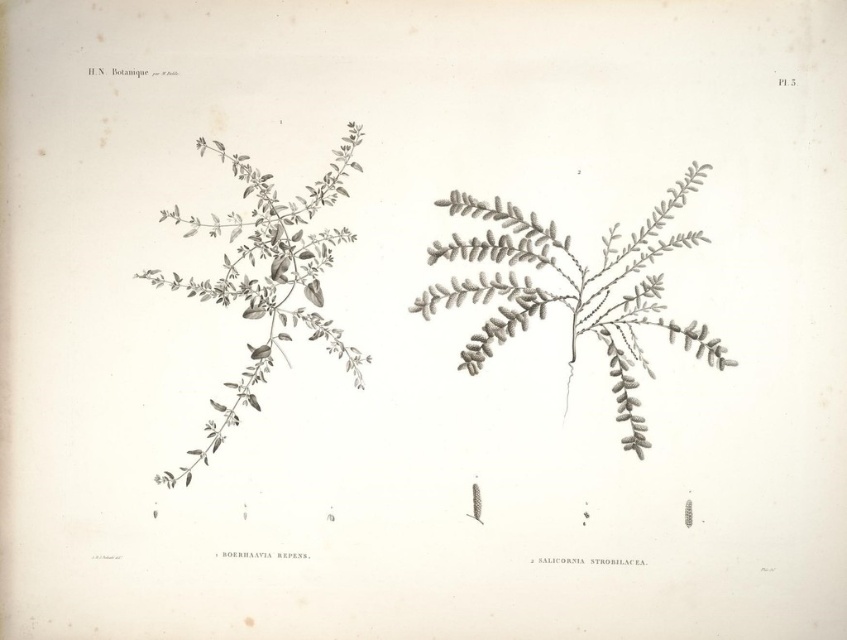
Based on the botanical illustration from H.N. Botanique, which plant is positioned lower in the image, the gray textured plant at center or the gray textured plant at left?

The gray textured plant at center is positioned lower than the gray textured plant at left in the image.

Based on the botanical illustration from H.N. Botanique labeled as Plate 5, where is the gray textured plant at center located in terms of coordinates?

The gray textured plant at center is located at point (571, 289).